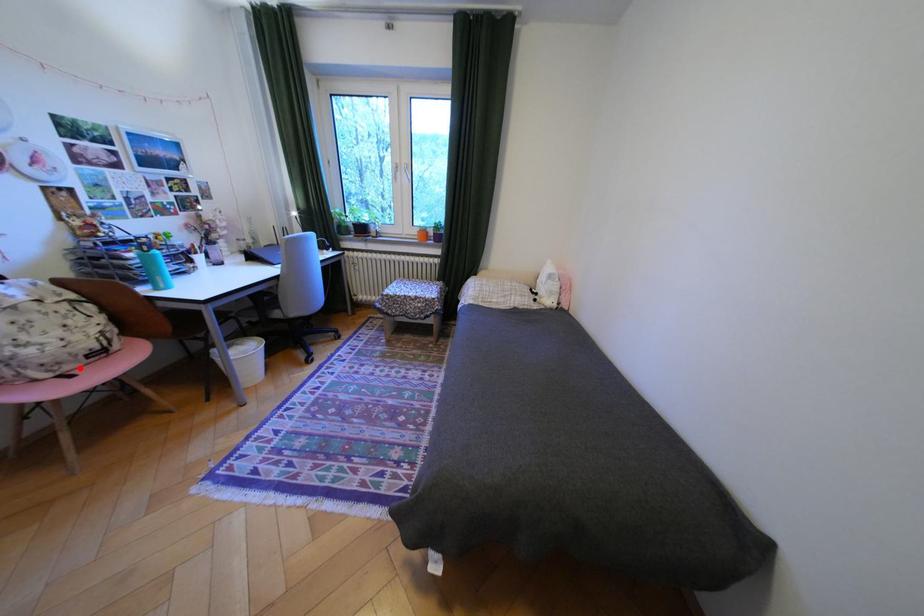
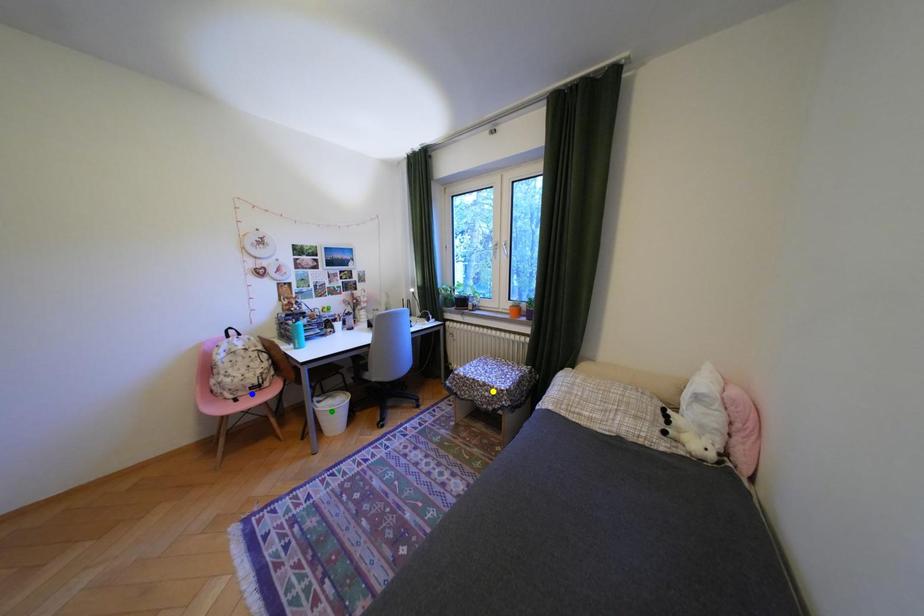
Question: I am providing you with two images of the same scene from different viewpoints. A red point is marked on the first image. You are given multiple points on the second image. In image 2, which mark is for the same physical point as the one in image 1?

Choices:
 (A) yellow point
 (B) green point
 (C) blue point

Answer: (C)